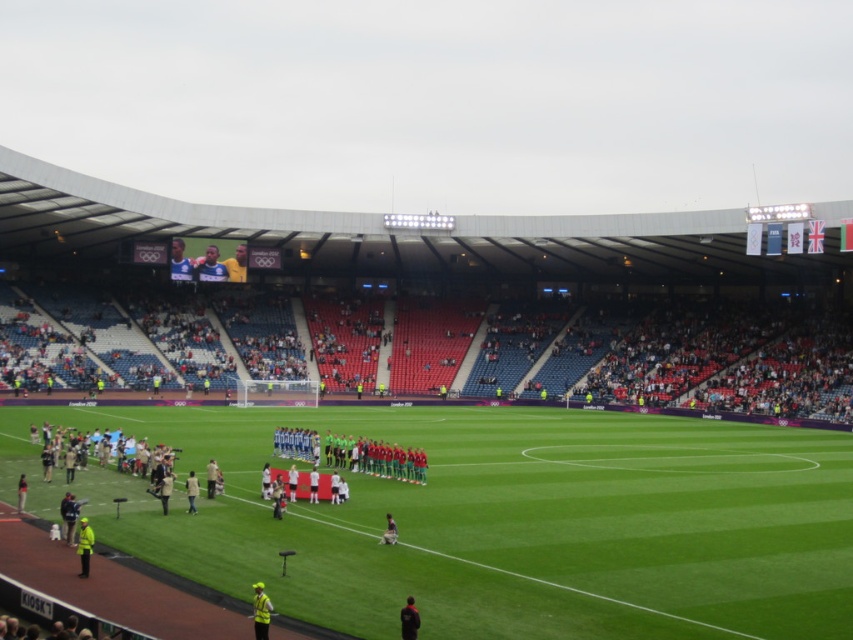
Question: Which of the following is the closest to the observer?

Choices:
 (A) light brown fabric jacket at center
 (B) smooth blue shirt at upper center
 (C) high visibility jacket at lower left

Answer: (C)

Question: Which object is farther from the camera taking this photo?

Choices:
 (A) white jersey at center
 (B) yellow jersey at upper center

Answer: (B)

Question: Considering the relative positions of white glossy uniform at center and yellow reflective vest at lower center in the image provided, where is white glossy uniform at center located with respect to yellow reflective vest at lower center?

Choices:
 (A) above
 (B) below

Answer: (B)

Question: Can you confirm if yellow fabric person at center is positioned below green jersey at center?

Choices:
 (A) yes
 (B) no

Answer: (B)

Question: Is the position of yellow reflective vest at lower center less distant than that of light brown fabric jacket at center?

Choices:
 (A) yes
 (B) no

Answer: (A)

Question: Which of the following is the closest to the observer?

Choices:
 (A) tap(178, 259)
 (B) tap(402, 632)
 (C) tap(166, 483)

Answer: (B)